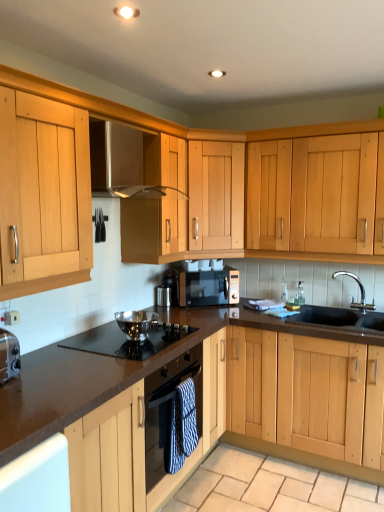
Find the location of `satin stainless steel exhaust hood at upper center`. satin stainless steel exhaust hood at upper center is located at coordinates (125, 162).

This screenshot has width=384, height=512. Describe the element at coordinates (264, 483) in the screenshot. I see `beige stone granite at lower center` at that location.

This screenshot has width=384, height=512. What do you see at coordinates (137, 323) in the screenshot?
I see `polished stainless steel bowl at center` at bounding box center [137, 323].

The image size is (384, 512). What do you see at coordinates (206, 287) in the screenshot?
I see `matte black microwave at center` at bounding box center [206, 287].

In order to face black granite sink at lower right, should I rotate leftwards or rightwards?

It's best to rotate right around 19.378 degrees.

I want to click on wooden cabinet at center, acting as the 2th cabinetry starting from the top, so click(125, 449).

The height and width of the screenshot is (512, 384). I want to click on satin stainless steel exhaust hood at upper center, so click(x=125, y=162).

From the picture: Is black granite sink at lower right shorter than wooden cabinet at center, which is the 2th cabinetry from back to front?

Correct, black granite sink at lower right is not as tall as wooden cabinet at center, which is the 2th cabinetry from back to front.

Find the location of a particular element. sink that is on the right side of wooden cabinet at center, which ranks as the 1th cabinetry in front-to-back order is located at coordinates (343, 315).

Which is more to the right, black granite sink at lower right or wooden cabinet at center, the first cabinetry ordered from the bottom?

black granite sink at lower right.

How far apart are black granite sink at lower right and wooden cabinet at center, the first cabinetry ordered from the bottom?

black granite sink at lower right and wooden cabinet at center, the first cabinetry ordered from the bottom, are 1.17 meters apart.

In the scene shown: Does black granite sink at lower right turn towards polished stainless steel bowl at center?

No, black granite sink at lower right is not turned towards polished stainless steel bowl at center.

Considering the points (332, 275) and (131, 320), which point is in front, point (332, 275) or point (131, 320)?

The point (131, 320) is closer.

Is black granite sink at lower right taller or shorter than polished stainless steel bowl at center?

Considering their sizes, black granite sink at lower right has more height than polished stainless steel bowl at center.

Considering the sizes of objects matte black microwave at center and wooden cabinet at center, acting as the 2th cabinetry starting from the top, in the image provided, who is wider, matte black microwave at center or wooden cabinet at center, acting as the 2th cabinetry starting from the top,?

wooden cabinet at center, acting as the 2th cabinetry starting from the top, is wider.

Which is in front, matte black microwave at center or wooden cabinet at center, which is the 2th cabinetry from back to front?

wooden cabinet at center, which is the 2th cabinetry from back to front, is closer to the camera.

The width and height of the screenshot is (384, 512). Identify the location of cabinetry on the left of matte black microwave at center. (125, 449).

Can you confirm if black granite sink at lower right is taller than satin stainless steel exhaust hood at upper center?

Yes.

From the image's perspective, is black granite sink at lower right over satin stainless steel exhaust hood at upper center?

No, from the image's perspective, black granite sink at lower right is not above satin stainless steel exhaust hood at upper center.

Is black granite sink at lower right smaller than satin stainless steel exhaust hood at upper center?

Incorrect, black granite sink at lower right is not smaller in size than satin stainless steel exhaust hood at upper center.

Can you tell me how much polished stainless steel bowl at center and polished stainless steel gas stove at center differ in facing direction?

0.166 degrees separate the facing orientations of polished stainless steel bowl at center and polished stainless steel gas stove at center.

Where is `appliance that appears on the right of polished stainless steel gas stove at center`? The image size is (384, 512). appliance that appears on the right of polished stainless steel gas stove at center is located at coordinates (137, 323).

Based on the photo, can you confirm if polished stainless steel bowl at center is thinner than polished stainless steel gas stove at center?

Indeed, polished stainless steel bowl at center has a lesser width compared to polished stainless steel gas stove at center.

Is polished stainless steel bowl at center taller than polished stainless steel gas stove at center?

Yes.

Which object is further away from the camera taking this photo, matte black microwave at center or black granite sink at lower right?

matte black microwave at center.

Can black granite sink at lower right be found inside matte black microwave at center?

Definitely not — black granite sink at lower right is not inside matte black microwave at center.

From the image's perspective, would you say matte black microwave at center is shown under black granite sink at lower right?

No, from the image's perspective, matte black microwave at center is not beneath black granite sink at lower right.

Considering the sizes of matte black microwave at center and black granite sink at lower right in the image, is matte black microwave at center wider or thinner than black granite sink at lower right?

In the image, matte black microwave at center appears to be more narrow than black granite sink at lower right.

What's the angular difference between polished stainless steel bowl at center and beige stone granite at lower center's facing directions?

polished stainless steel bowl at center and beige stone granite at lower center are facing 180 degrees away from each other.

Can you confirm if polished stainless steel bowl at center is positioned to the left of beige stone granite at lower center?

Yes, polished stainless steel bowl at center is to the left of beige stone granite at lower center.

Is polished stainless steel bowl at center oriented away from beige stone granite at lower center?

No, beige stone granite at lower center is not at the back of polished stainless steel bowl at center.

From a real-world perspective, is polished stainless steel bowl at center on top of beige stone granite at lower center?

Yes, from a real-world perspective, polished stainless steel bowl at center is on top of beige stone granite at lower center.

This screenshot has height=512, width=384. In order to click on cabinetry beneath the black granite sink at lower right (from a real-world perspective) in this screenshot , I will do `click(125, 449)`.

At what (x,y) coordinates should I click in order to perform the action: click on sink above the polished stainless steel bowl at center (from the image's perspective). Please return your answer as a coordinate pair (x, y). The height and width of the screenshot is (512, 384). Looking at the image, I should click on (343, 315).

From the image, which object appears to be nearer to matte black microwave at center, brown laminate countertop at center or light wood cabinet at center, marked as the second cabinetry in a bottom-to-top arrangement?

Among the two, light wood cabinet at center, marked as the second cabinetry in a bottom-to-top arrangement, is located nearer to matte black microwave at center.

When comparing their distances from matte black microwave at center, does polished stainless steel bowl at center or light wood cabinet at center, which is counted as the 1th cabinetry, starting from the back, seem closer?

light wood cabinet at center, which is counted as the 1th cabinetry, starting from the back, lies closer to matte black microwave at center than the other object.

From the image, which object appears to be farther from wooden cabinet at center, acting as the 2th cabinetry starting from the top, matte black microwave at center or polished stainless steel bowl at center?

Among the two, matte black microwave at center is located further to wooden cabinet at center, acting as the 2th cabinetry starting from the top.

From the image, which object appears to be nearer to satin stainless steel exhaust hood at upper center, beige stone granite at lower center or polished stainless steel bowl at center?

polished stainless steel bowl at center.

From the image, which object appears to be nearer to polished stainless steel gas stove at center, wooden cabinet at center, the first cabinetry ordered from the bottom, or light wood cabinet at center, which is counted as the 1th cabinetry, starting from the back?

Based on the image, wooden cabinet at center, the first cabinetry ordered from the bottom, appears to be nearer to polished stainless steel gas stove at center.

Which object lies nearer to the anchor point beige stone granite at lower center, polished stainless steel bowl at center or black granite sink at lower right?

black granite sink at lower right lies closer to beige stone granite at lower center than the other object.

Considering their positions, is black granite sink at lower right positioned further to polished stainless steel bowl at center than light wood cabinet at center, acting as the second cabinetry starting from the front?

Among the two, black granite sink at lower right is located further to polished stainless steel bowl at center.

From the image, which object appears to be nearer to wooden cabinet at center, which ranks as the 1th cabinetry in front-to-back order, polished stainless steel gas stove at center or beige stone granite at lower center?

polished stainless steel gas stove at center lies closer to wooden cabinet at center, which ranks as the 1th cabinetry in front-to-back order, than the other object.

This screenshot has height=512, width=384. I want to click on granite situated between polished stainless steel bowl at center and black granite sink at lower right from left to right, so click(264, 483).

This screenshot has height=512, width=384. I want to click on gas stove between polished stainless steel bowl at center and beige stone granite at lower center from top to bottom, so click(x=127, y=340).

Find the location of a particular element. This screenshot has width=384, height=512. appliance between polished stainless steel gas stove at center and black granite sink at lower right in the horizontal direction is located at coordinates (137, 323).

In order to click on appliance between wooden cabinet at center, which is the 2th cabinetry from back to front, and black granite sink at lower right from left to right in this screenshot , I will do `click(137, 323)`.